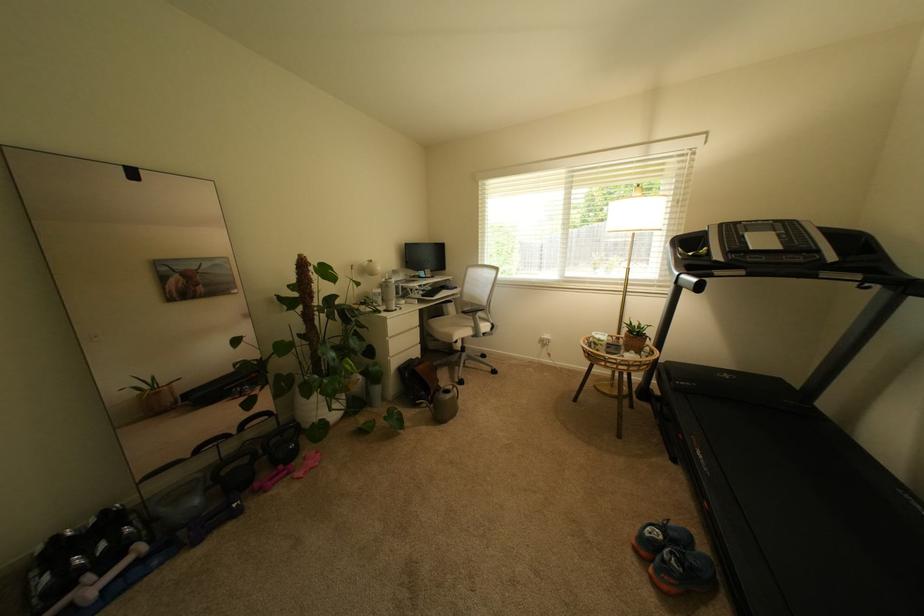
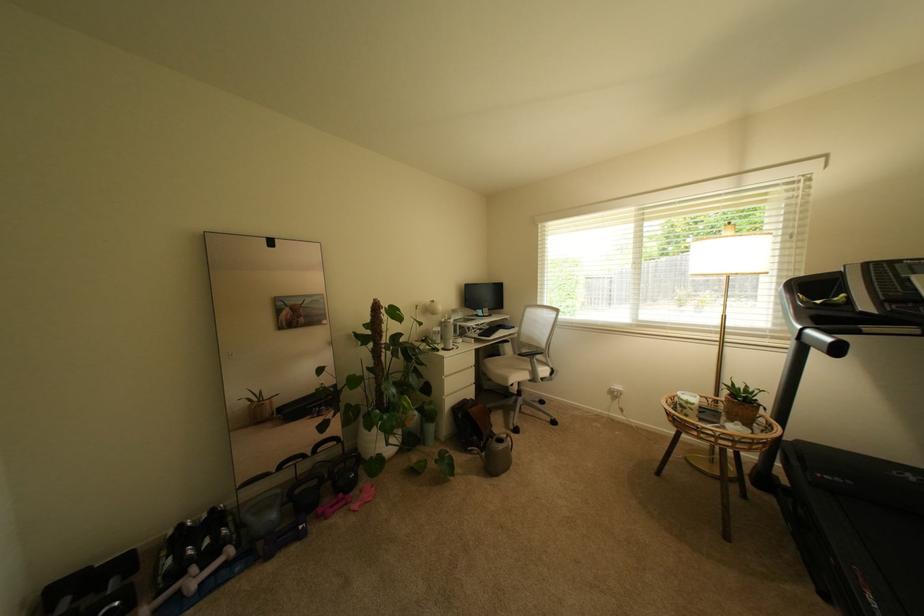
Find the pixel in the second image that matches pixel 301 464 in the first image.

(359, 495)